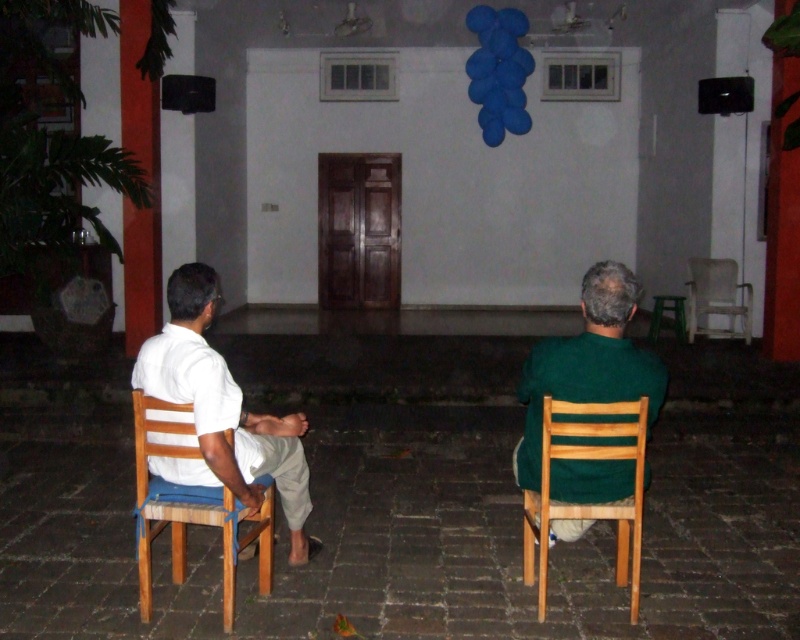
Which is below, white plastic chair at right or green plastic stool at lower right?

Positioned lower is green plastic stool at lower right.

Is point (716, 269) in front of point (678, 298)?

Yes, it is.

The image size is (800, 640). I want to click on white plastic chair at right, so click(716, 298).

Between point (564, 428) and point (666, 305), which one is positioned in front?

Point (564, 428)

From the picture: Measure the distance between point (576, 451) and camera.

Point (576, 451) and camera are 3.50 meters apart.

What are the coordinates of `wooden chair at right` in the screenshot? It's located at (588, 502).

Consider the image. Does wooden chair at left lie in front of white plastic chair at right?

That is True.

Is point (166, 484) in front of point (742, 333)?

Yes, it is.

Where is `wooden chair at left`? The width and height of the screenshot is (800, 640). wooden chair at left is located at coordinates (192, 509).